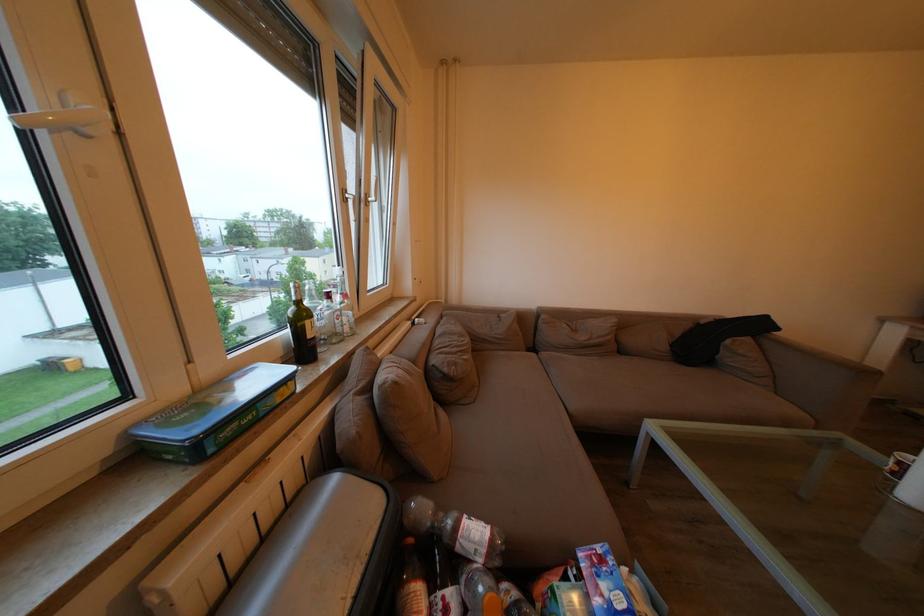
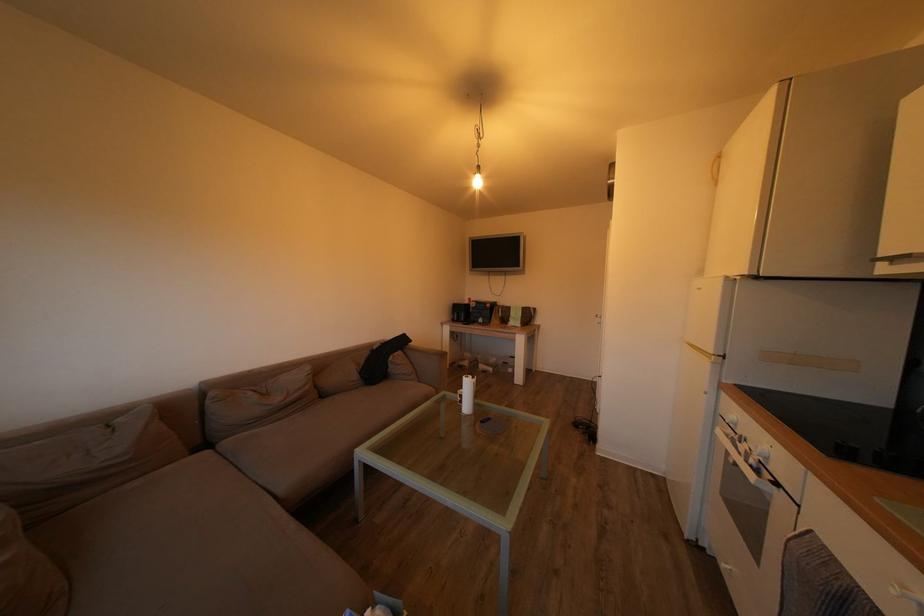
Locate, in the second image, the point that corresponds to (x=629, y=358) in the first image.

(331, 402)